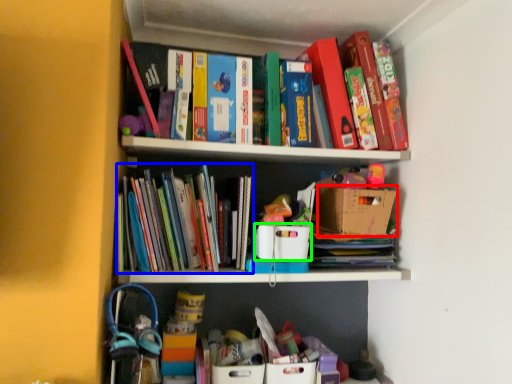
Question: Which object is positioned farthest from cardboard box (highlighted by a red box)? Select from book (highlighted by a blue box) and cardboard box (highlighted by a green box).

Choices:
 (A) book
 (B) cardboard box

Answer: (A)